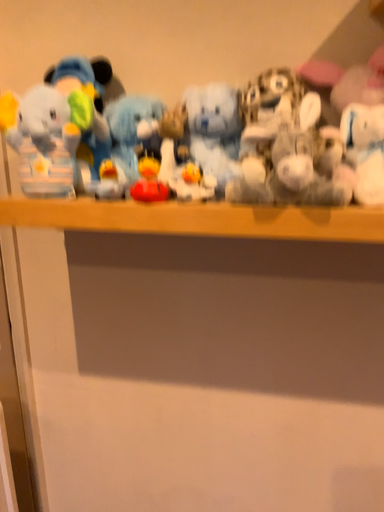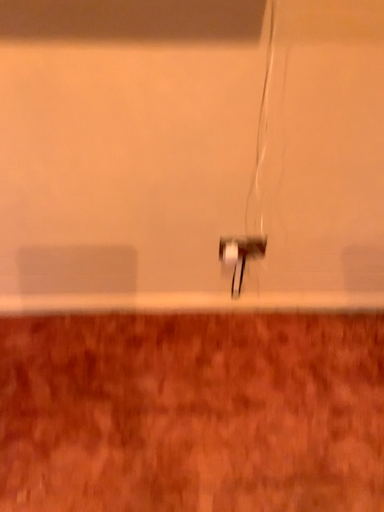
Question: Which way did the camera rotate in the video?

Choices:
 (A) rotated upward
 (B) rotated downward

Answer: (B)